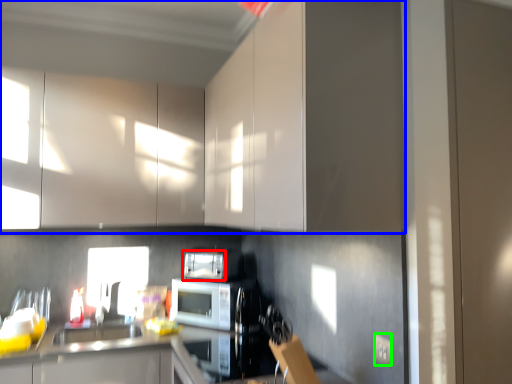
Question: Which object is the closest to the appliance (highlighted by a red box)? Choose among these: cabinetry (highlighted by a blue box) or electric outlet (highlighted by a green box).

Choices:
 (A) cabinetry
 (B) electric outlet

Answer: (A)